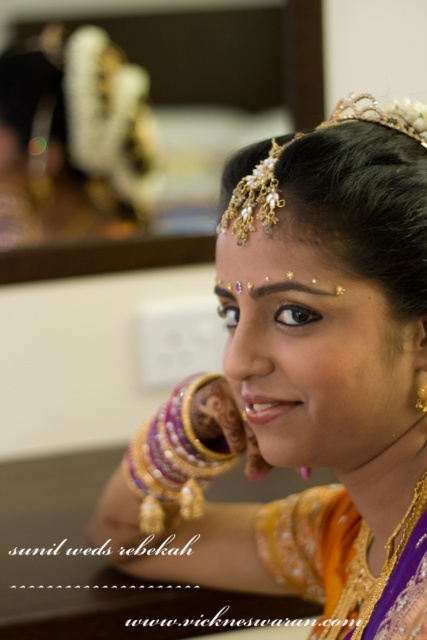
Can you confirm if goldmetallicbracelet at center is shorter than purple/golden bangle at upper center?

In fact, goldmetallicbracelet at center may be taller than purple/golden bangle at upper center.

In the scene shown: Can you confirm if goldmetallicbracelet at center is positioned below purple/golden bangle at upper center?

Incorrect, goldmetallicbracelet at center is not positioned below purple/golden bangle at upper center.

Is point (376, 212) positioned behind point (169, 480)?

No, (376, 212) is in front of (169, 480).

Find the location of a particular element. Image resolution: width=427 pixels, height=640 pixels. goldmetallicbracelet at center is located at coordinates (304, 387).

Can you confirm if goldmetallicbracelet at center is thinner than gold textured tiara at upper center?

No, goldmetallicbracelet at center is not thinner than gold textured tiara at upper center.

Who is higher up, goldmetallicbracelet at center or gold textured tiara at upper center?

gold textured tiara at upper center is above.

Does point (408, 632) lie in front of point (248, 216)?

Yes, point (408, 632) is in front of point (248, 216).

Find the location of `goldmetallicbracelet at center`. goldmetallicbracelet at center is located at coordinates coord(304,387).

Measure the distance between purple/golden bangle at upper center and gold textured tiara at upper center.

A: They are 38.22 centimeters apart.

Can you confirm if purple/golden bangle at upper center is thinner than gold textured tiara at upper center?

Indeed, purple/golden bangle at upper center has a lesser width compared to gold textured tiara at upper center.

Who is more distant from viewer, (x=183, y=467) or (x=248, y=186)?

Positioned behind is point (x=183, y=467).

Find the location of a particular element. purple/golden bangle at upper center is located at coordinates (172, 460).